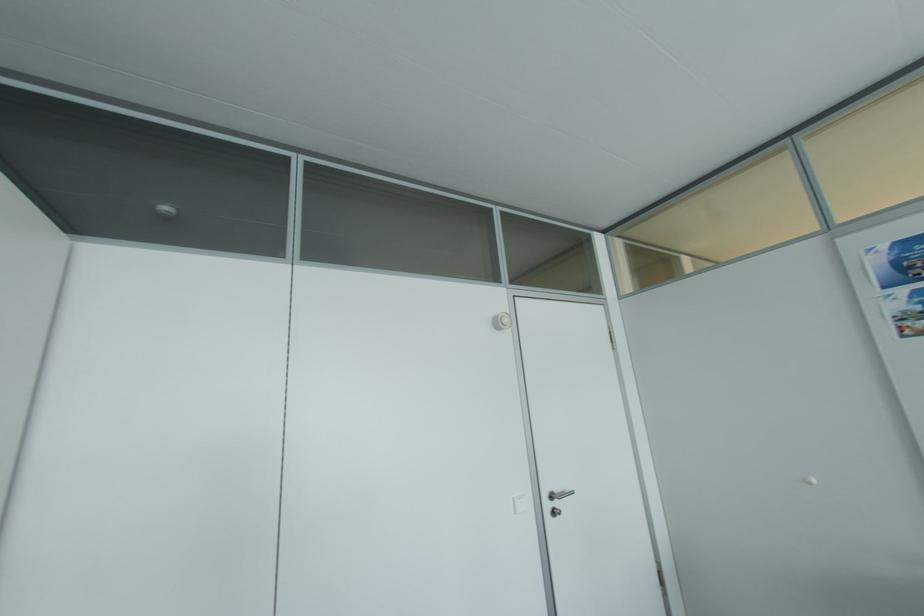
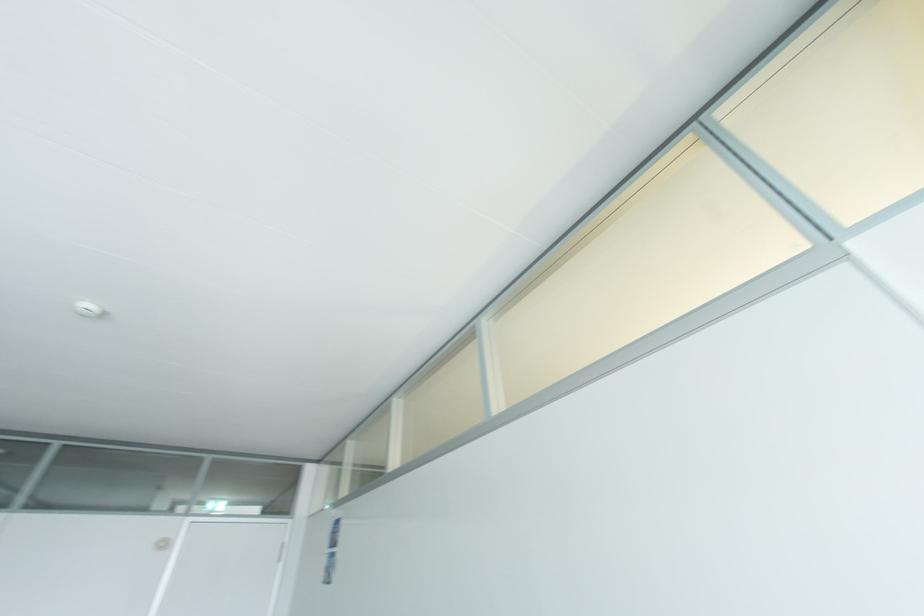
What movement of the cameraman would produce the second image?

The cameraman walked toward right, backward.